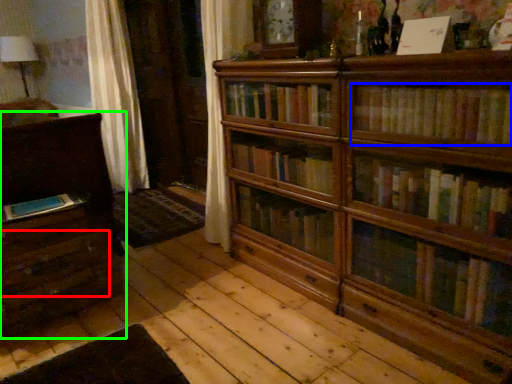
Question: Which object is positioned closest to drawer (highlighted by a red box)? Select from book (highlighted by a blue box) and chest of drawers (highlighted by a green box).

Choices:
 (A) book
 (B) chest of drawers

Answer: (B)